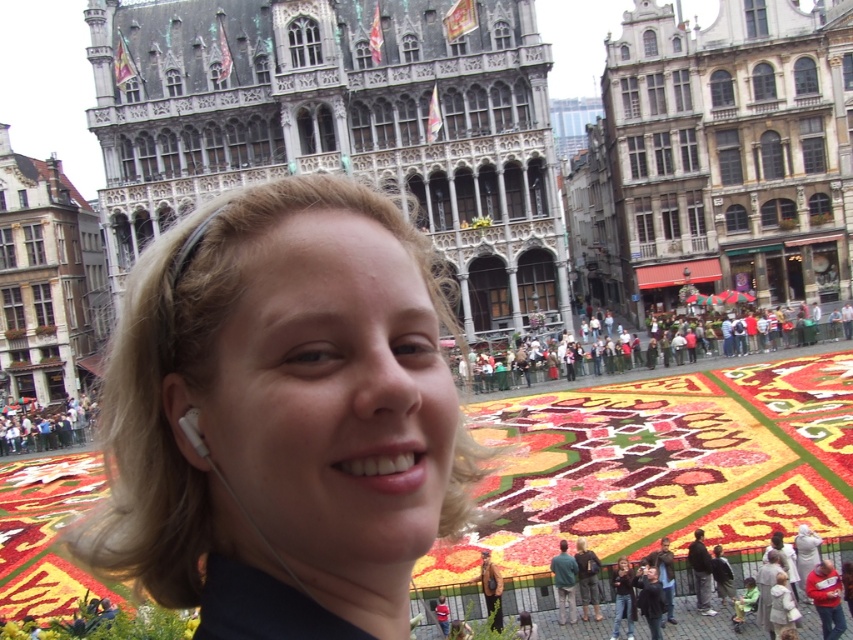
You are a photographer positioned at the center of the town square. You want to capture a photo that includes both the floral carpet in the middle ground and the person with blonde hair at center. Based on their positions, will the person be in the foreground or background of the photo?

The blonde hair at center is located at point 0.648 on the x and 0.331 on the y. Since the floral carpet is in the middle ground and the person is at the center, the person would be in the foreground of the photo.

You are a tourist in the historic town square. You see the dark gray stone building at upper center and the stone building at center. Which one appears bigger to you?

The dark gray stone building at upper center appears bigger than the stone building at center because it is larger in size.